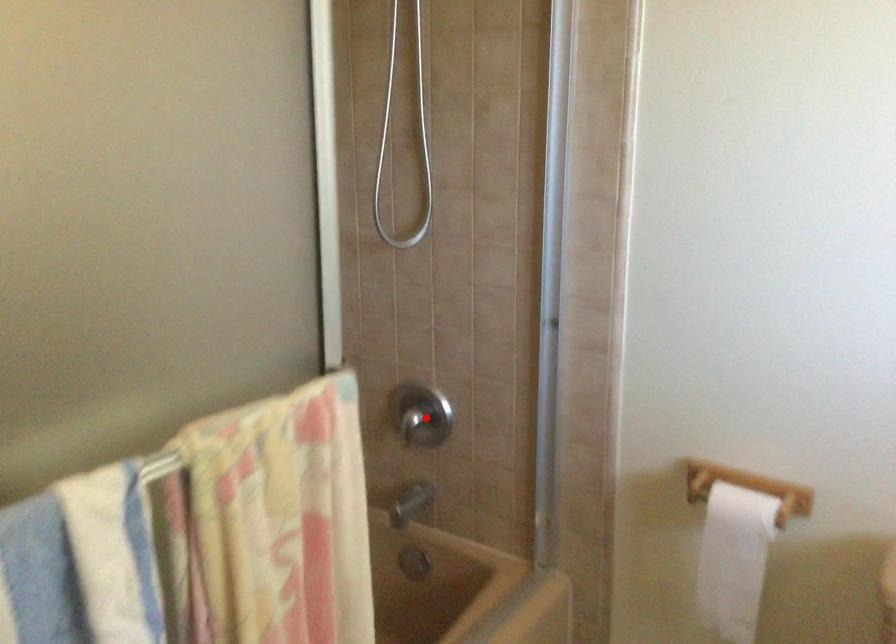
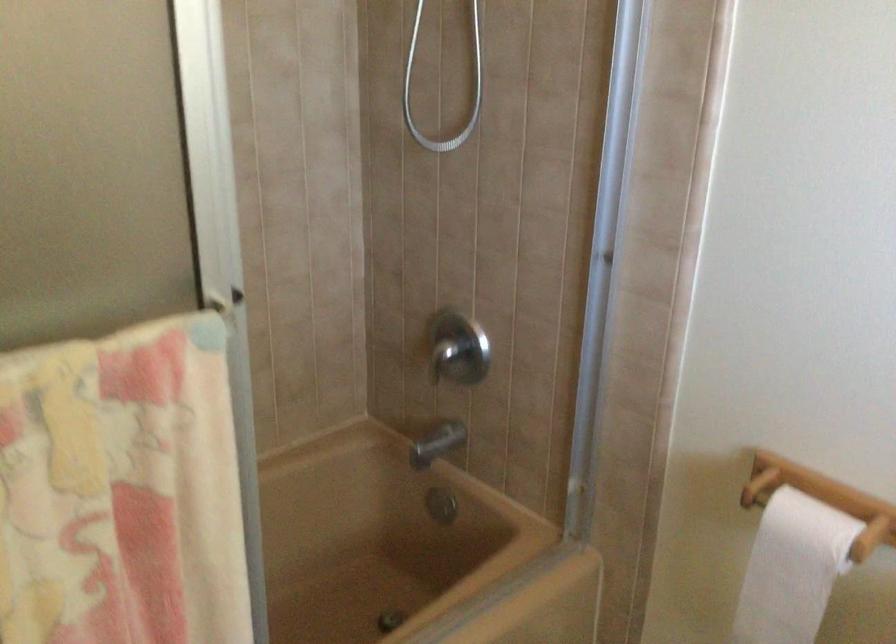
Question: A red point is marked in image1. In image2, is the corresponding 3D point closer to the camera or farther? Reply with the corresponding letter.

Choices:
 (A) The corresponding 3D point is closer.
 (B) The corresponding 3D point is farther.

Answer: (A)